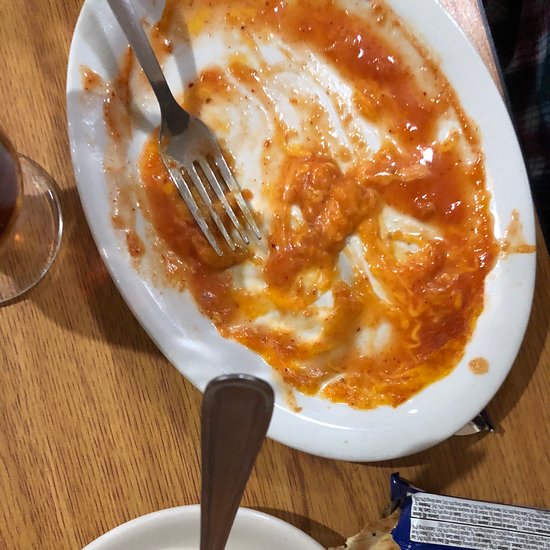
Where is `wooden tabletop`? The width and height of the screenshot is (550, 550). wooden tabletop is located at coordinates (76, 412), (474, 18).